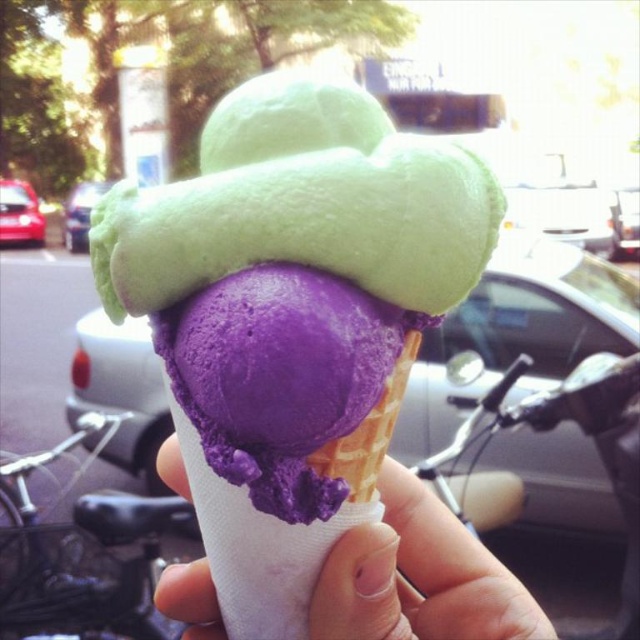
Question: Is purple matte ice cream at center thinner than purple matte ice cream cone at center?

Choices:
 (A) yes
 (B) no

Answer: (A)

Question: Among these points, which one is farthest from the camera?

Choices:
 (A) (332, 612)
 (B) (228, 108)

Answer: (B)

Question: Is purple matte ice cream at center closer to the viewer compared to purple matte ice cream cone at center?

Choices:
 (A) no
 (B) yes

Answer: (B)

Question: Which point is closer to the camera taking this photo?

Choices:
 (A) (184, 609)
 (B) (291, 147)

Answer: (B)

Question: From the image, what is the correct spatial relationship of purple matte ice cream at center in relation to purple matte ice cream cone at center?

Choices:
 (A) above
 (B) below

Answer: (A)